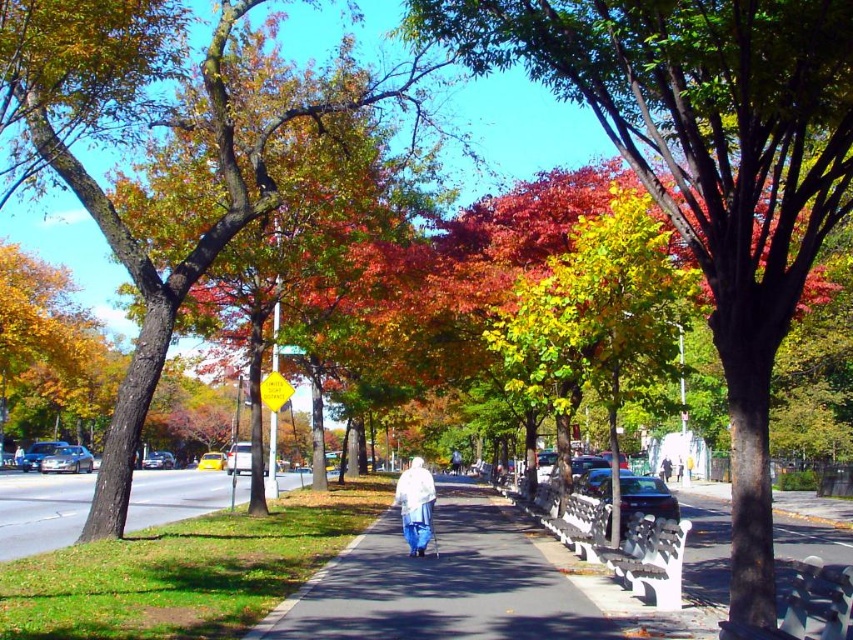
Question: Which point is farther from the camera taking this photo?

Choices:
 (A) [x=90, y=19]
 (B) [x=408, y=500]
 (C) [x=572, y=65]

Answer: (B)

Question: Which of the following is the farthest from the observer?

Choices:
 (A) (653, 164)
 (B) (430, 529)

Answer: (A)

Question: Is green leafy tree at center bigger than white fabric coat at center?

Choices:
 (A) yes
 (B) no

Answer: (A)

Question: Which point is closer to the camera?

Choices:
 (A) (374, 99)
 (B) (511, 38)
 (C) (198, 483)
 (D) (409, 554)

Answer: (B)

Question: Is green leafy tree at center closer to the viewer compared to white fabric coat at center?

Choices:
 (A) no
 (B) yes

Answer: (B)

Question: Observing the image, what is the correct spatial positioning of green leafy tree at center in reference to smooth brown tree trunk at center?

Choices:
 (A) above
 (B) below

Answer: (B)